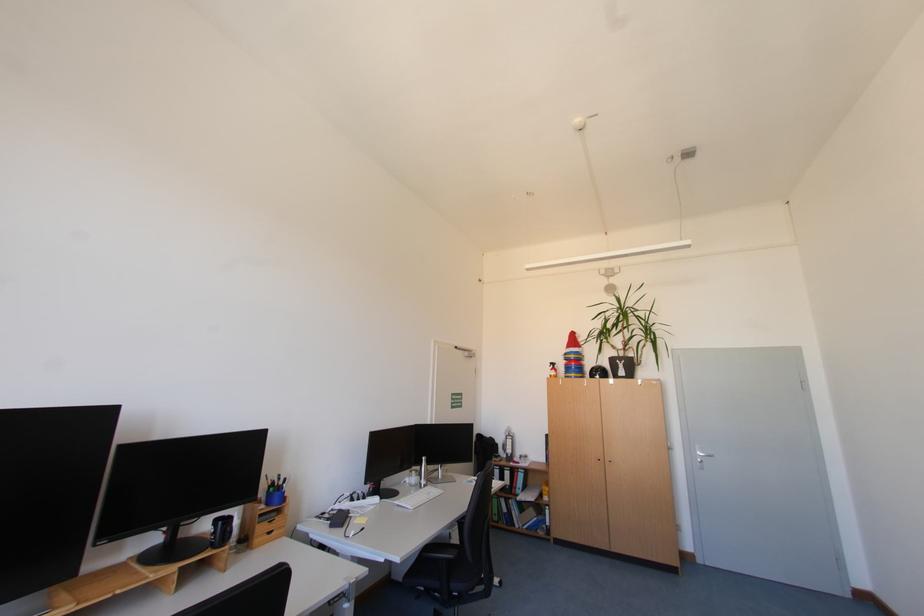
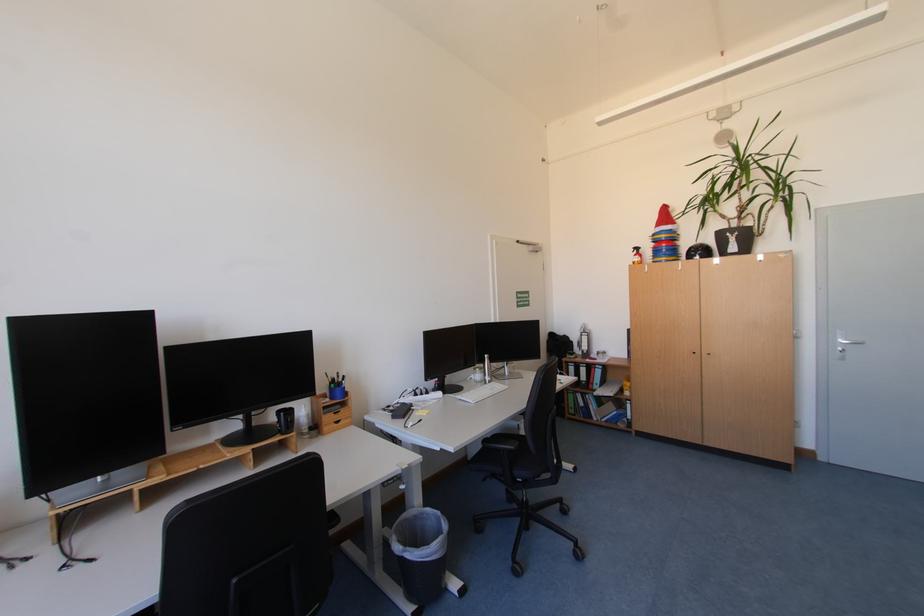
The point at [524,474] is marked in the first image. Where is the corresponding point in the second image?

(601, 370)